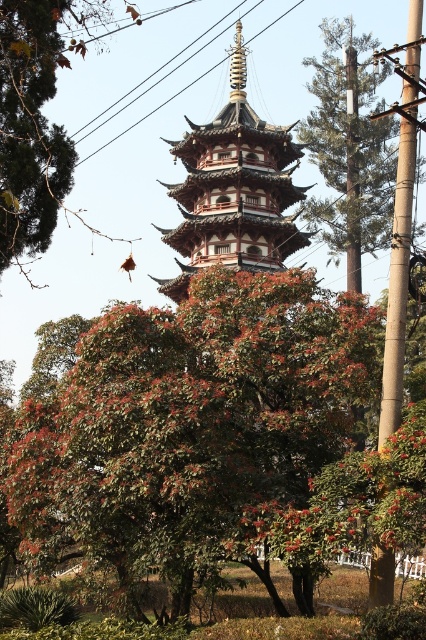
You are standing in front of the pagoda and want to take a photo of the bamboo pole at right without the green textured tree at upper right blocking it. How should you position yourself?

Move to the left side of the green textured tree at upper right so that the bamboo pole at right is visible without obstruction from the tree.

You are standing in front of the pagoda and want to determine the spatial relationship between two points marked on the pagoda structure. The first point is at coordinate point (370, 64), and the second is at coordinate point (400, 317). Which point is closer to you?

Point (370, 64) is closer to you because it is further to the viewer than point (400, 317).

You are standing in front of the wooden pagoda at center and want to take a photo of it without any obstructions. However, the green textured tree at upper right is blocking your view. Can you move to a position where the tree is no longer in front of the pagoda?

The green textured tree at upper right is behind the wooden pagoda at center, so you don not need to move. The tree is already behind the pagoda, so your current position allows for an unobstructed view of the pagoda.